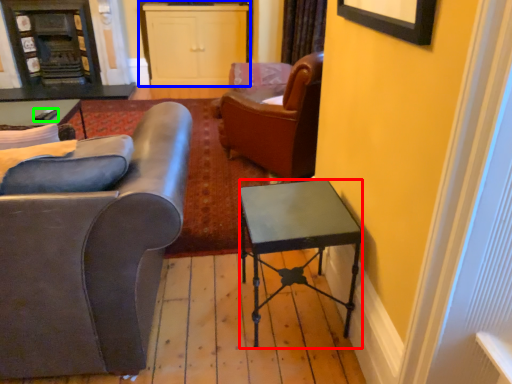
Question: Which object is the farthest from desk (highlighted by a red box)? Choose among these: cabinetry (highlighted by a blue box) or remote control (highlighted by a green box).

Choices:
 (A) cabinetry
 (B) remote control

Answer: (A)